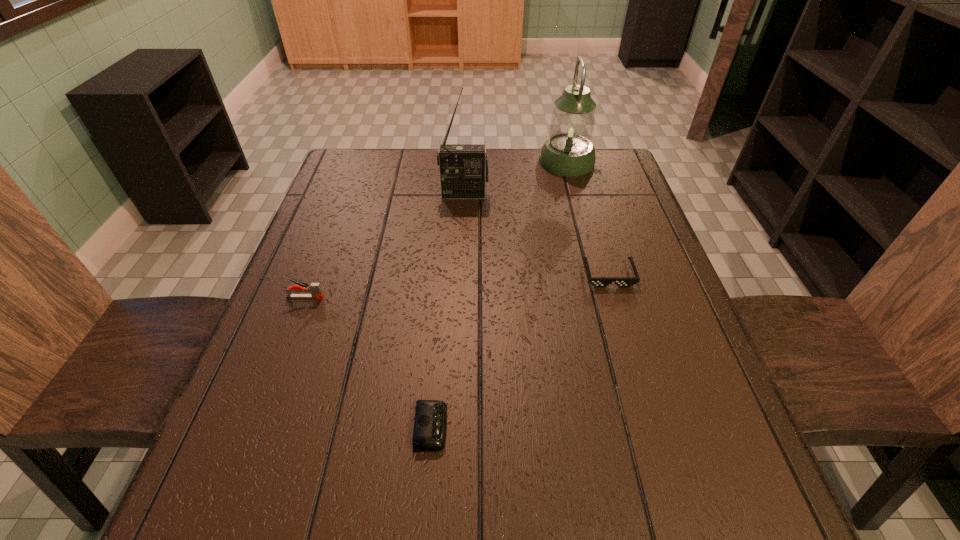
Locate an element on the screen. Image resolution: width=960 pixels, height=540 pixels. free space that is in between the stapler and the second farthest object is located at coordinates (385, 246).

The height and width of the screenshot is (540, 960). I want to click on empty space between the third farthest object and the lantern, so click(588, 218).

Where is `free space between the lantern and the alarm clock`? The width and height of the screenshot is (960, 540). free space between the lantern and the alarm clock is located at coordinates (499, 294).

The image size is (960, 540). Find the location of `free point between the fourth farthest object and the sunglasses`. free point between the fourth farthest object and the sunglasses is located at coordinates (457, 286).

Identify which object is the second nearest to the farthest object. Please provide its 2D coordinates. Your answer should be formatted as a tuple, i.e. [(x, y)], where the tuple contains the x and y coordinates of a point satisfying the conditions above.

[(599, 282)]

You are a GUI agent. You are given a task and a screenshot of the screen. Output one action in this format:
    pyautogui.click(x=<x>, y=<y>)
    Task: Click on the object that is the third closest to the second farthest object
    The width and height of the screenshot is (960, 540).
    Given the screenshot: What is the action you would take?
    pyautogui.click(x=315, y=289)

At what (x,y) coordinates should I click in order to perform the action: click on vacant space that satisfies the following two spatial constraints: 1. on the front-facing side of the sunglasses; 2. on the display of the nearest object. Please return your answer as a coordinate pair (x, y). This screenshot has height=540, width=960. Looking at the image, I should click on (653, 427).

Where is `free space that satisfies the following two spatial constraints: 1. on the front-facing side of the sunglasses; 2. on the handle side of the third tallest object`? free space that satisfies the following two spatial constraints: 1. on the front-facing side of the sunglasses; 2. on the handle side of the third tallest object is located at coordinates (615, 297).

The height and width of the screenshot is (540, 960). Find the location of `blank space that satisfies the following two spatial constraints: 1. on the display of the radio receiver; 2. on the display of the nearest object`. blank space that satisfies the following two spatial constraints: 1. on the display of the radio receiver; 2. on the display of the nearest object is located at coordinates (454, 427).